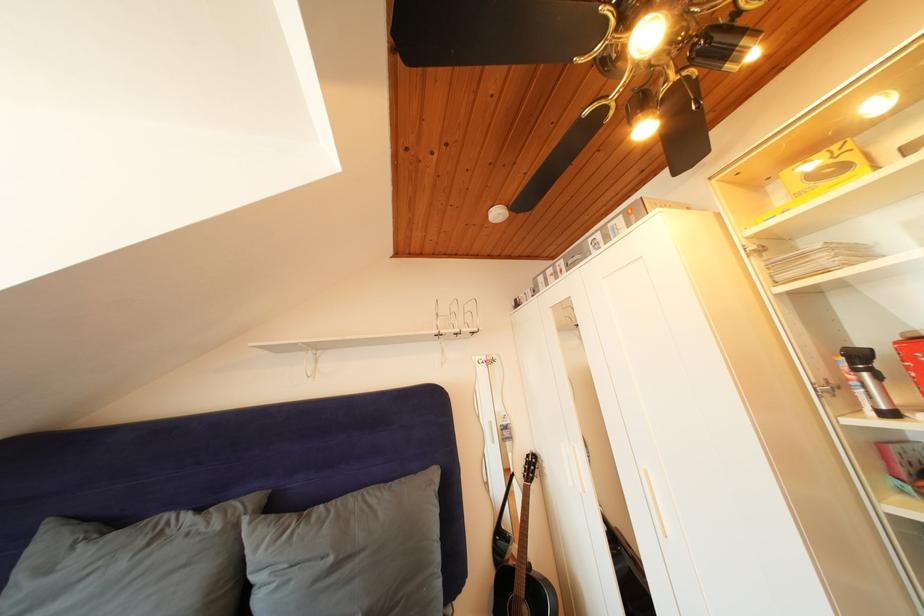
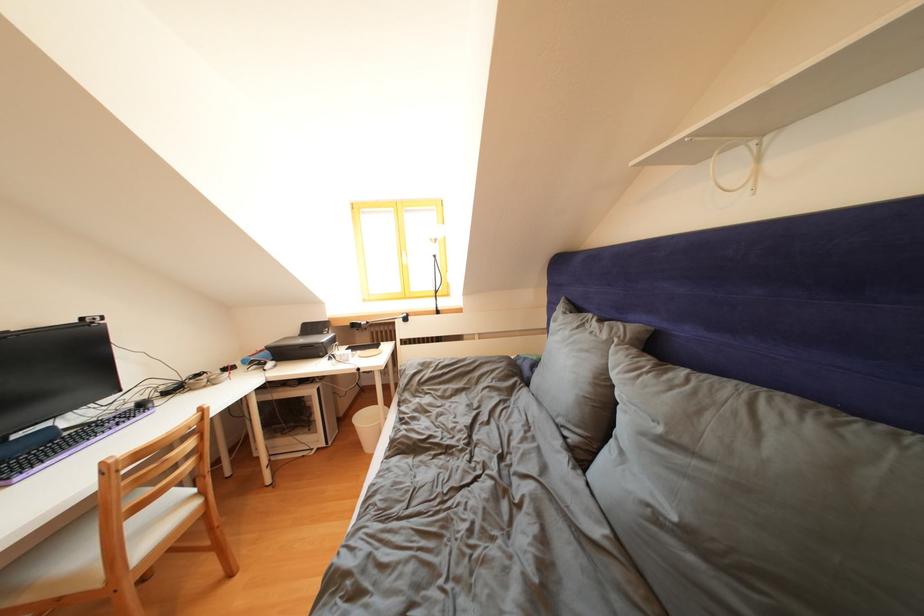
In the second image, find the point that corresponds to pixel 225 531 in the first image.

(612, 341)